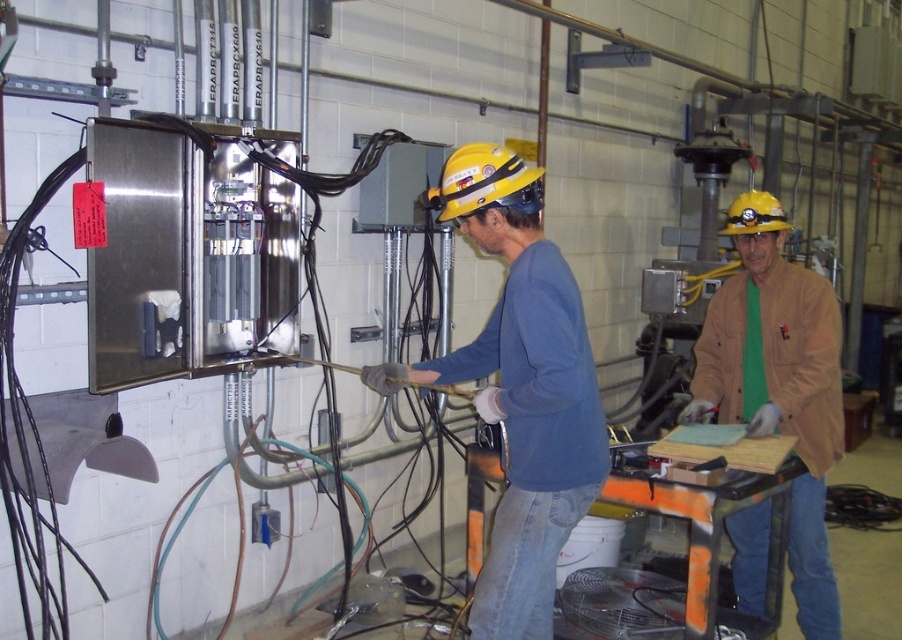
Question: Estimate the real-world distances between objects in this image. Which object is closer to the blue matte shirt at center?

Choices:
 (A) yellow hard hat at upper center
 (B) brown leather jacket at center

Answer: (B)

Question: Is brown leather jacket at center smaller than yellow hard hat at center?

Choices:
 (A) no
 (B) yes

Answer: (A)

Question: Based on their relative distances, which object is nearer to the blue matte shirt at center?

Choices:
 (A) yellow hard hat at center
 (B) yellow hard hat at upper center

Answer: (A)

Question: Is the position of yellow hard hat at center less distant than that of yellow hard hat at upper center?

Choices:
 (A) no
 (B) yes

Answer: (B)

Question: Which of the following is the farthest from the observer?

Choices:
 (A) (755, 353)
 (B) (770, 204)
 (C) (428, 204)

Answer: (C)

Question: Does brown leather jacket at center have a greater width compared to yellow hard hat at upper center?

Choices:
 (A) no
 (B) yes

Answer: (B)